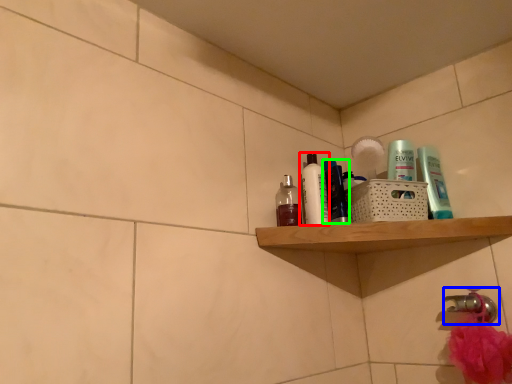
Question: Which object is the closest to the toiletry (highlighted by a red box)? Choose among these: tap (highlighted by a blue box) or toiletry (highlighted by a green box).

Choices:
 (A) tap
 (B) toiletry

Answer: (B)